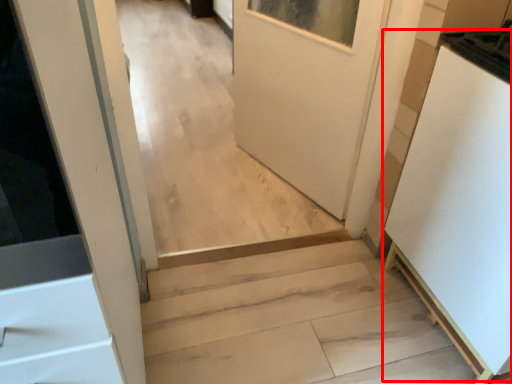
Question: From the image's perspective, where is appliance (annotated by the red box) located relative to stairs?

Choices:
 (A) below
 (B) above

Answer: (B)